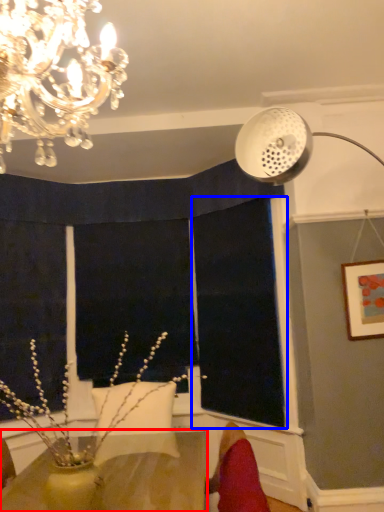
Question: Among these objects, which one is farthest to the camera, table (highlighted by a red box) or window screen (highlighted by a blue box)?

Choices:
 (A) table
 (B) window screen

Answer: (B)